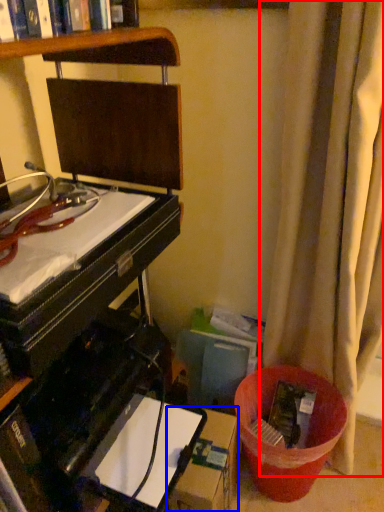
Question: Among these objects, which one is nearest to the camera, curtain (highlighted by a red box) or cardboard box (highlighted by a blue box)?

Choices:
 (A) curtain
 (B) cardboard box

Answer: (A)